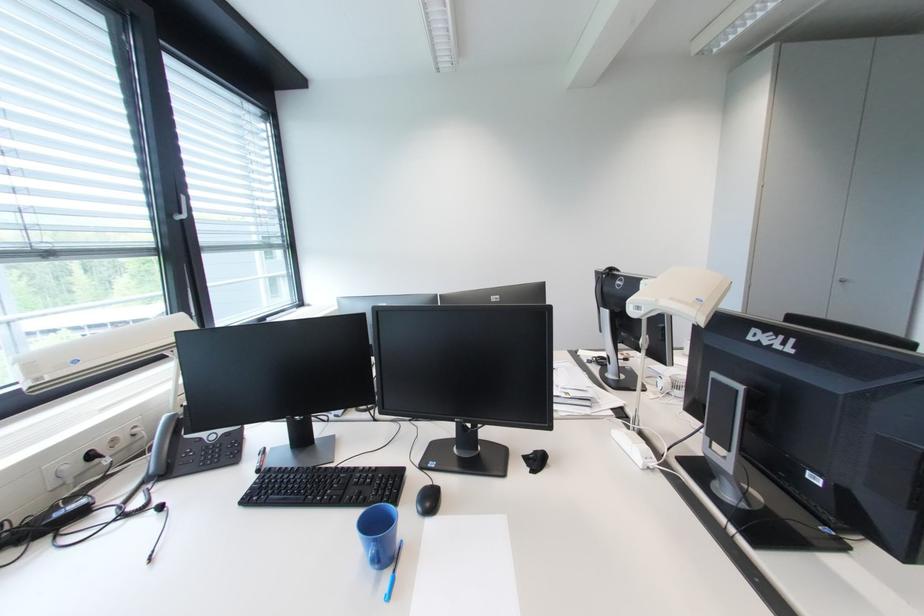
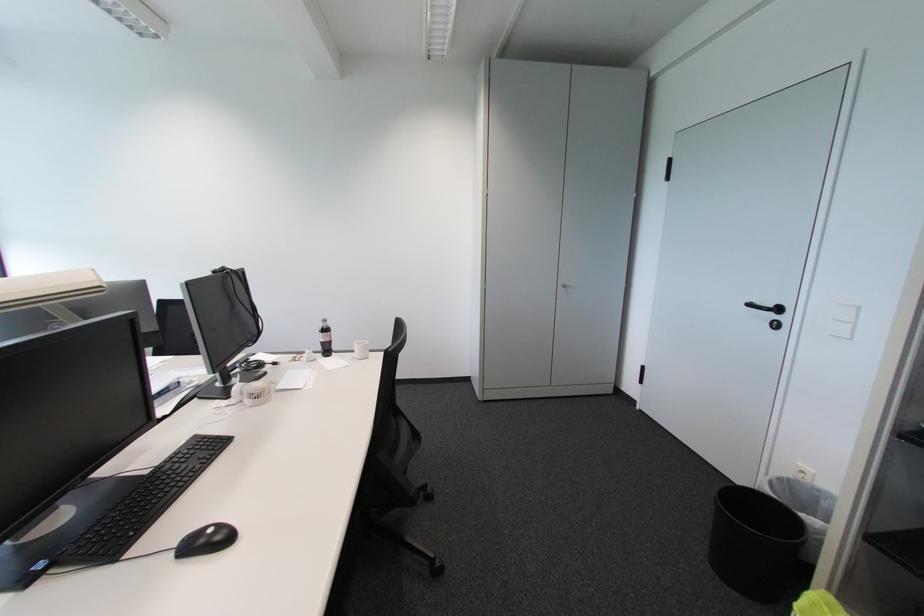
Where in the second image is the point corresponding to (844,285) from the first image?

(567, 290)